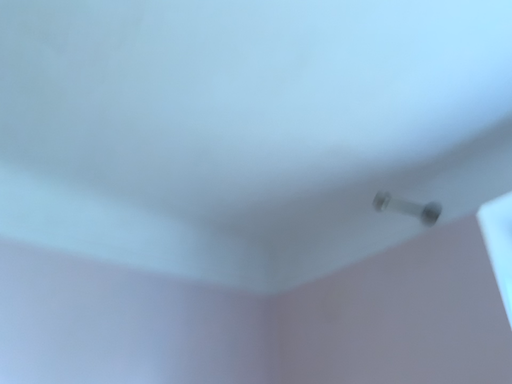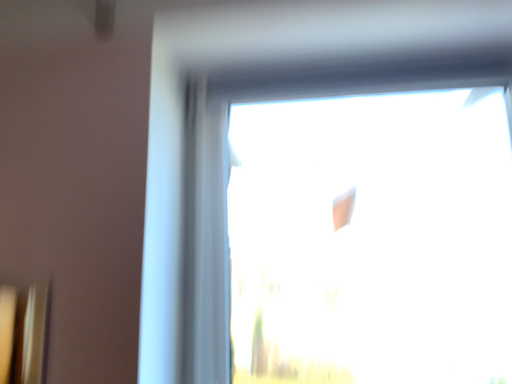
Question: How did the camera likely rotate when shooting the video?

Choices:
 (A) rotated right
 (B) rotated left

Answer: (A)